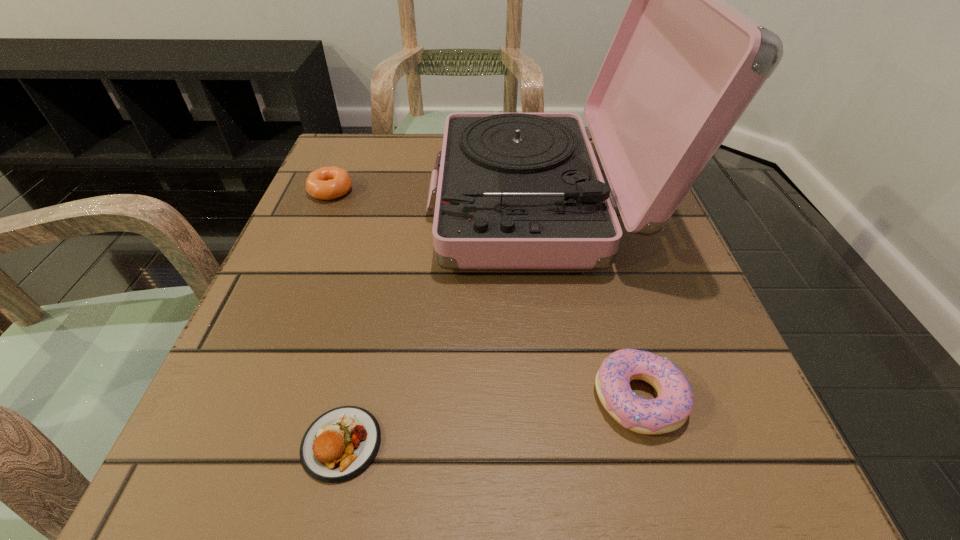
The height and width of the screenshot is (540, 960). I want to click on object located in the far left corner section of the desktop, so click(327, 183).

Identify the location of object located at the near left corner. (340, 444).

You are a GUI agent. You are given a task and a screenshot of the screen. Output one action in this format:
    pyautogui.click(x=<x>, y=<y>)
    Task: Click on the object that is at the far right corner
    
    Given the screenshot: What is the action you would take?
    pyautogui.click(x=515, y=190)

I want to click on object that is at the near right corner, so click(x=669, y=411).

The width and height of the screenshot is (960, 540). In the image, there is a desktop. Identify the location of blank space at the near edge. (456, 483).

The image size is (960, 540). I want to click on free space at the left edge of the desktop, so click(x=294, y=319).

Where is `vacant space at the right edge of the desktop`? vacant space at the right edge of the desktop is located at coordinates (677, 345).

Locate an element on the screen. vacant region at the near left corner of the desktop is located at coordinates (184, 511).

This screenshot has height=540, width=960. I want to click on vacant region between the shortest object and the tallest object, so click(x=442, y=323).

Identify the location of unoccupied area between the right doughnut and the tallest object. The height and width of the screenshot is (540, 960). (590, 300).